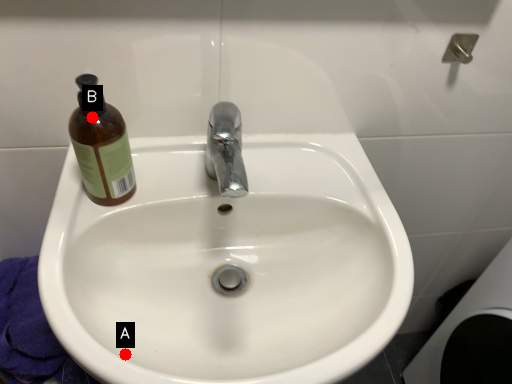
Question: Two points are circled on the image, labeled by A and B beside each circle. Which point is further to the camera?

Choices:
 (A) A is further
 (B) B is further

Answer: (B)